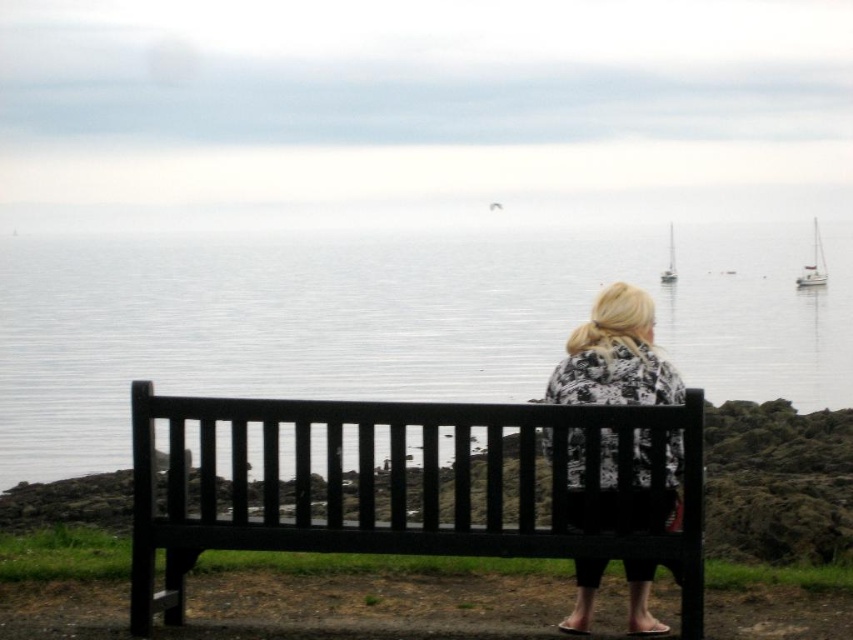
Can you confirm if black wood bench at center is shorter than white glossy sailboat at upper center?

Yes.

Is black wood bench at center bigger than white glossy sailboat at upper center?

No.

Between point (219, 406) and point (675, 266), which one is positioned in front?

Point (219, 406)

Find the location of `black wood bench at center`. black wood bench at center is located at coordinates (402, 488).

Is smooth water at center smaller than white glossy sailboat at right?

No.

Who is positioned more to the left, smooth water at center or white glossy sailboat at right?

From the viewer's perspective, smooth water at center appears more on the left side.

Which is in front, point (225, 243) or point (813, 266)?

Point (813, 266)

Locate an element on the screen. smooth water at center is located at coordinates (386, 321).

Looking at this image, how distant is smooth water at center from printed fabric jacket at center?

They are 24.27 meters apart.

Is point (45, 422) positioned after point (656, 365)?

That is True.

Between point (82, 262) and point (676, 456), which one is positioned behind?

Point (82, 262)

Where is `smooth water at center`? smooth water at center is located at coordinates (386, 321).